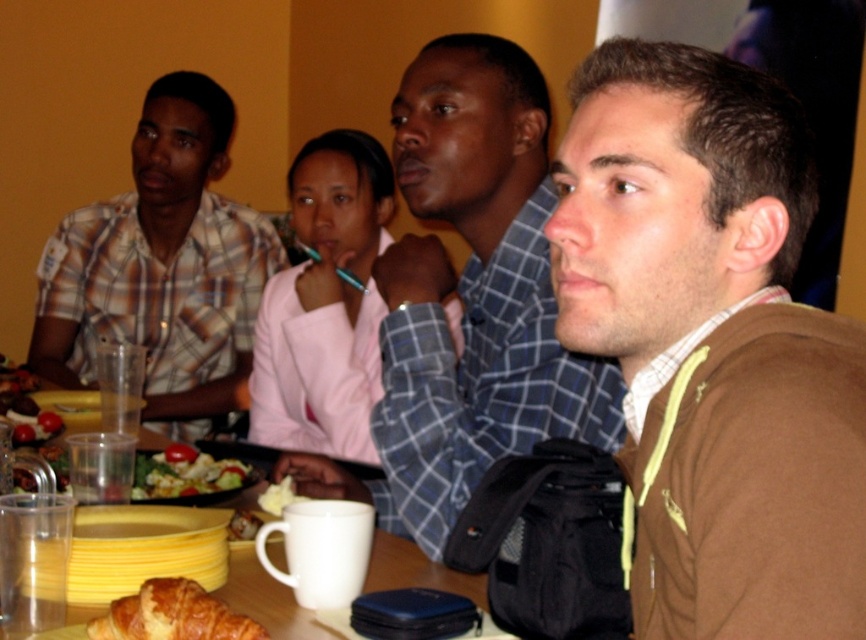
Question: Does brown fleece jacket at center appear on the right side of smooth brown bread at lower left?

Choices:
 (A) no
 (B) yes

Answer: (B)

Question: Does golden brown flaky croissant at lower left appear over fresh green salad at lower left?

Choices:
 (A) yes
 (B) no

Answer: (B)

Question: Can you confirm if golden brown flaky croissant at lower left is thinner than smooth brown bread at lower left?

Choices:
 (A) no
 (B) yes

Answer: (A)

Question: Among these points, which one is nearest to the camera?

Choices:
 (A) (255, 524)
 (B) (406, 577)
 (C) (178, 608)
 (D) (399, 524)

Answer: (C)

Question: Considering the real-world distances, which object is farthest from the white matte cup at center?

Choices:
 (A) smooth brown bread at lower left
 (B) golden brown flaky croissant at lower left
 (C) matte blue shirt at center

Answer: (C)

Question: Which point is farther to the camera?

Choices:
 (A) (247, 620)
 (B) (250, 513)

Answer: (B)